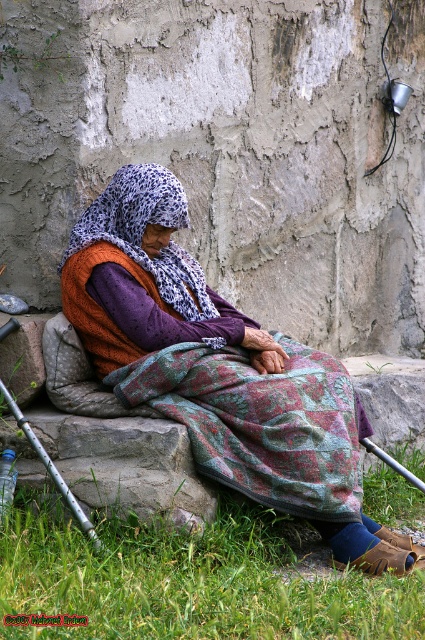
Question: Is gray rough stone at lower left to the right of floral fabric shawl at center from the viewer's perspective?

Choices:
 (A) no
 (B) yes

Answer: (A)

Question: Which is nearer to the silver metallic cane at lower left?

Choices:
 (A) floral woven blanket at lower center
 (B) green grass at lower center
 (C) floral fabric shawl at center
 (D) patterned fabric headscarf at center

Answer: (B)

Question: Does patterned fabric headscarf at center lie behind floral woven blanket at lower center?

Choices:
 (A) yes
 (B) no

Answer: (B)

Question: Considering the real-world distances, which object is farthest from the silver metallic cane at lower left?

Choices:
 (A) green grass at lower center
 (B) floral fabric shawl at center

Answer: (B)

Question: Can you confirm if floral woven blanket at lower center is smaller than gray rough stone at lower left?

Choices:
 (A) yes
 (B) no

Answer: (B)

Question: Which of the following is the closest to the observer?

Choices:
 (A) (181, 387)
 (B) (141, 627)
 (C) (198, 492)

Answer: (B)